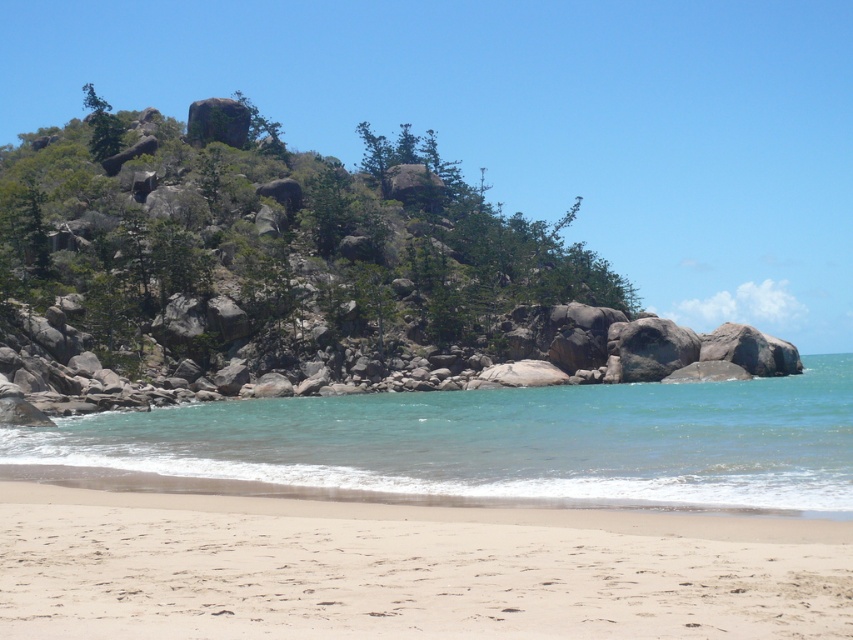
Does light beige sand at lower center have a lesser height compared to clear blue water at lower center?

Yes.

Is light beige sand at lower center above clear blue water at lower center?

Yes.

Locate an element on the screen. light beige sand at lower center is located at coordinates (405, 570).

I want to click on light beige sand at lower center, so click(x=405, y=570).